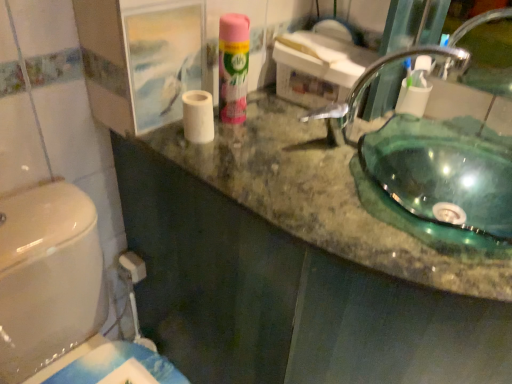
Find the location of a particular element. This screenshot has width=512, height=384. vacant space situated above green marble counter top at center (from a real-world perspective) is located at coordinates (347, 163).